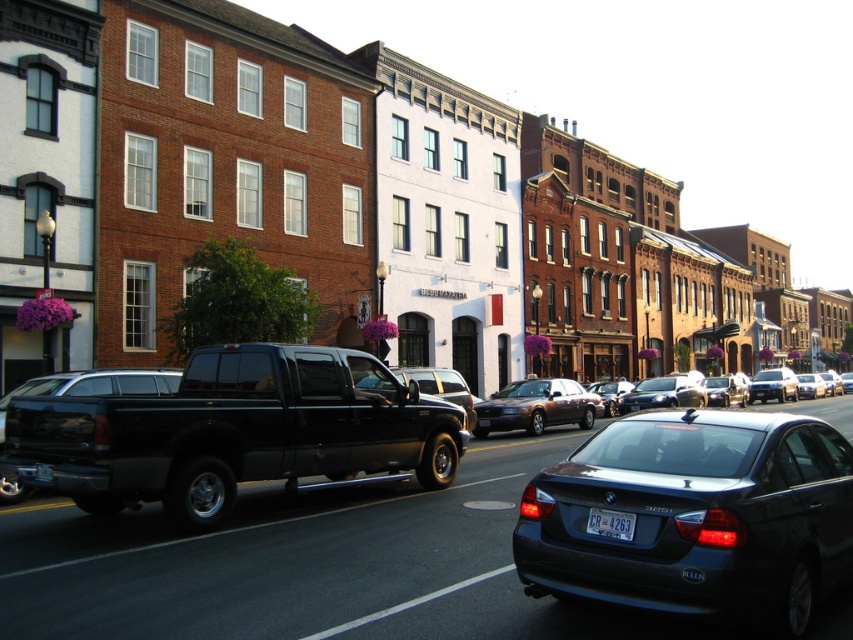
Can you confirm if black matte truck at center is positioned to the right of white plastic license plate at center?

No, black matte truck at center is not to the right of white plastic license plate at center.

Is black matte truck at center wider than white plastic license plate at center?

Yes, black matte truck at center is wider than white plastic license plate at center.

Does point (236, 440) come behind point (605, 522)?

Yes, point (236, 440) is behind point (605, 522).

Where is `black matte truck at center`? Image resolution: width=853 pixels, height=640 pixels. black matte truck at center is located at coordinates (233, 432).

Between point (480, 413) and point (660, 401), which one is positioned in front?

Point (480, 413) is in front.

Identify the location of metallic brown sedan at center. (537, 406).

At what (x,y) coordinates should I click in order to perform the action: click on metallic brown sedan at center. Please return your answer as a coordinate pair (x, y). This screenshot has height=640, width=853. Looking at the image, I should click on (537, 406).

The height and width of the screenshot is (640, 853). In order to click on metallic brown sedan at center in this screenshot , I will do `click(537, 406)`.

Who is more forward, (538, 390) or (631, 538)?

Positioned in front is point (631, 538).

At what (x,y) coordinates should I click in order to perform the action: click on metallic brown sedan at center. Please return your answer as a coordinate pair (x, y). This screenshot has height=640, width=853. Looking at the image, I should click on (537, 406).